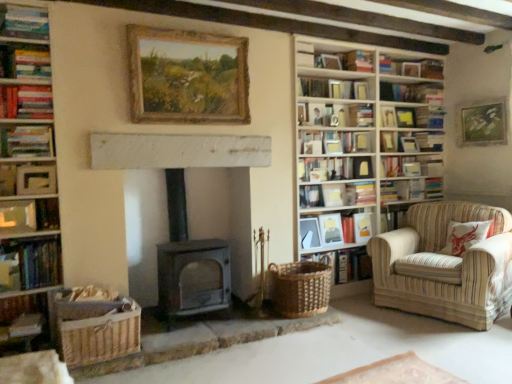
At what (x,y) coordinates should I click in order to perform the action: click on vacant region above hardcover book at upper left, the 10th book when ordered from bottom to top (from a real-world perspective). Please return your answer as a coordinate pair (x, y). Image resolution: width=512 pixels, height=384 pixels. Looking at the image, I should click on (21, 84).